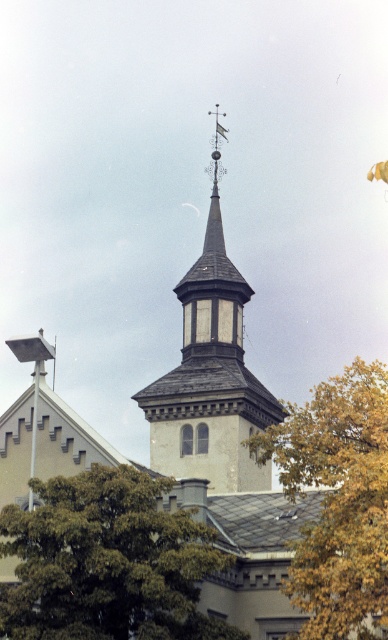
Which is above, green leafy tree at lower left or smooth gray steeple at center?

smooth gray steeple at center is higher up.

Who is more forward, (x=114, y=634) or (x=135, y=394)?

Point (x=114, y=634) is more forward.

In order to click on green leafy tree at lower left in this screenshot , I will do `click(107, 563)`.

Is yellow leafy tree at upper right taller than smooth gray steeple at center?

In fact, yellow leafy tree at upper right may be shorter than smooth gray steeple at center.

Between point (318, 451) and point (240, 458), which one is positioned behind?

The point (240, 458) is more distant.

Locate an element on the screen. yellow leafy tree at upper right is located at coordinates (337, 499).

Is green leafy tree at lower left in front of yellow leafy tree at upper right?

Yes.

Which is more to the right, green leafy tree at lower left or yellow leafy tree at upper right?

From the viewer's perspective, yellow leafy tree at upper right appears more on the right side.

I want to click on green leafy tree at lower left, so click(x=107, y=563).